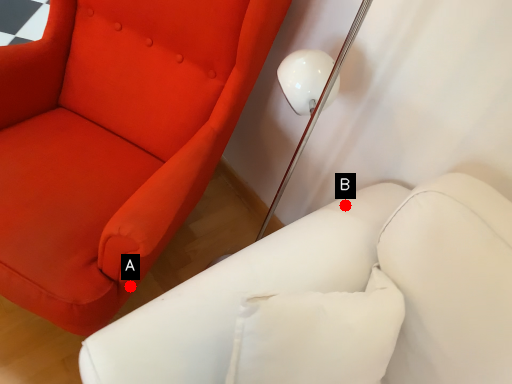
Question: Two points are circled on the image, labeled by A and B beside each circle. Which point is closer to the camera taking this photo?

Choices:
 (A) A is closer
 (B) B is closer

Answer: (B)